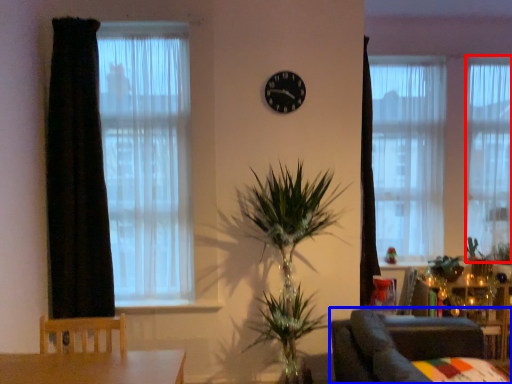
Question: Which object appears farthest to the camera in this image, curtain (highlighted by a red box) or furniture (highlighted by a blue box)?

Choices:
 (A) curtain
 (B) furniture

Answer: (A)